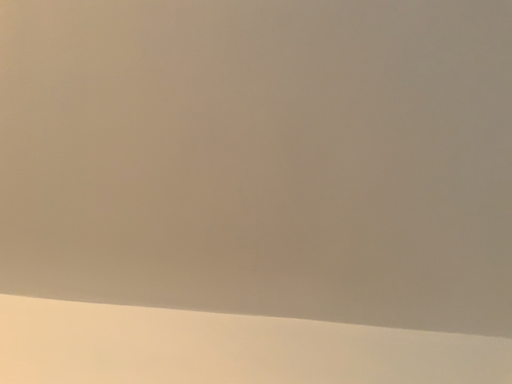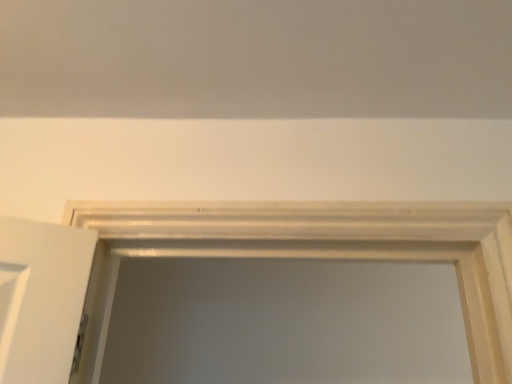
Question: How did the camera likely rotate when shooting the video?

Choices:
 (A) rotated left
 (B) rotated right

Answer: (A)